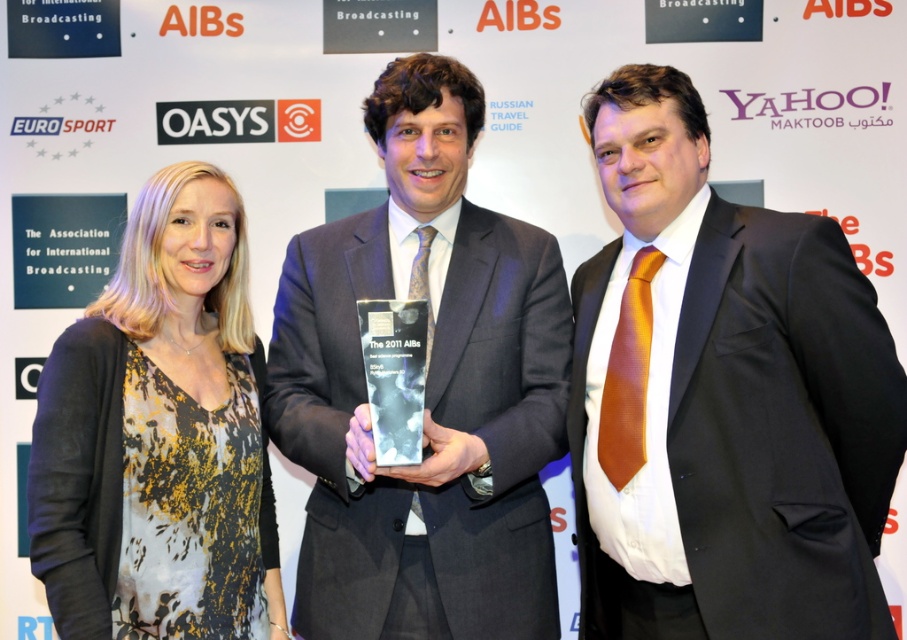
Question: Is matte black suit at center to the left of printed silk blouse at left from the viewer's perspective?

Choices:
 (A) yes
 (B) no

Answer: (B)

Question: Does matte black suit at center have a lesser width compared to printed silk blouse at left?

Choices:
 (A) yes
 (B) no

Answer: (B)

Question: Which point is closer to the camera?

Choices:
 (A) (245, 493)
 (B) (896, 385)

Answer: (B)

Question: Where is matte black suit at center located in relation to printed silk blouse at left in the image?

Choices:
 (A) left
 (B) right

Answer: (B)

Question: Which of the following is the closest to the observer?

Choices:
 (A) (47, 515)
 (B) (800, 612)
 (C) (391, 564)

Answer: (B)

Question: Which object is positioned closest to the matte black suit at center?

Choices:
 (A) black satin suit at center
 (B) printed silk blouse at left

Answer: (B)